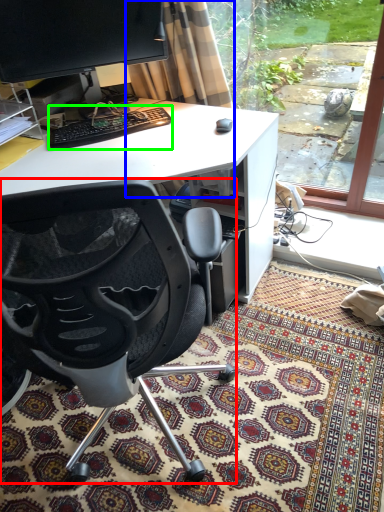
Question: Based on their relative distances, which object is nearer to chair (highlighted by a red box)? Choose from curtain (highlighted by a blue box) and computer keyboard (highlighted by a green box).

Choices:
 (A) curtain
 (B) computer keyboard

Answer: (B)